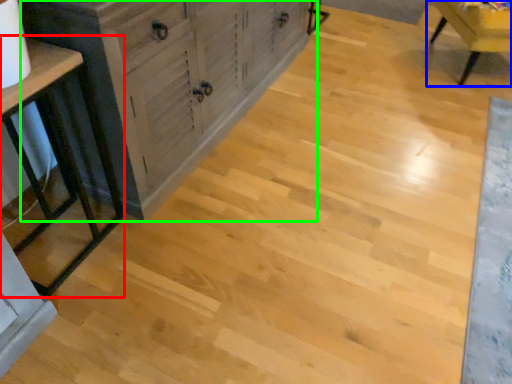
Question: Considering the real-world distances, which object is closest to table (highlighted by a red box)? chair (highlighted by a blue box) or cabinetry (highlighted by a green box).

Choices:
 (A) chair
 (B) cabinetry

Answer: (B)